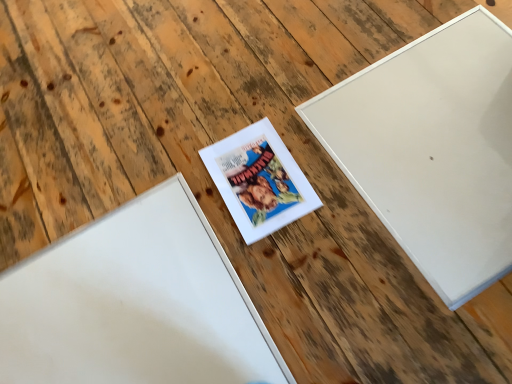
Locate an element on the screen. The image size is (512, 384). free point behind white matte picture frame at upper right, which appears as the third picture frame when viewed from the left is located at coordinates (335, 33).